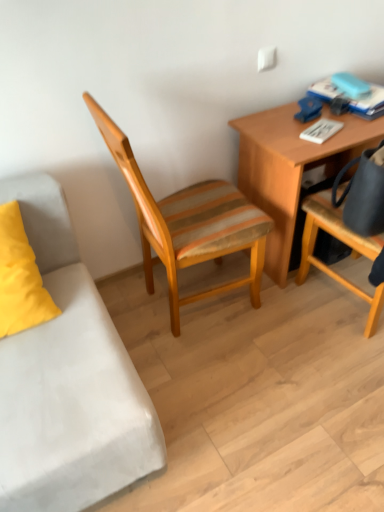
Question: Is wooden desk at upper right wider or thinner than woodenchair at center, which is the 1th chair from left to right?

Choices:
 (A) thin
 (B) wide

Answer: (A)

Question: Is wooden desk at upper right in front of or behind woodenchair at center, which is the 1th chair from left to right, in the image?

Choices:
 (A) front
 (B) behind

Answer: (B)

Question: Which object is positioned closest to the wooden desk at upper right?

Choices:
 (A) woodenchair at center, which is the 1th chair from left to right
 (B) matte black bag at right, arranged as the second chair when viewed from the left

Answer: (B)

Question: Which object is the closest to the woodenchair at center, which is the second chair in right-to-left order?

Choices:
 (A) wooden desk at upper right
 (B) matte black bag at right, the 1th chair positioned from the right

Answer: (A)